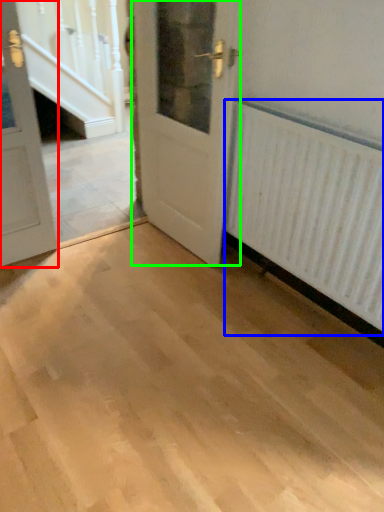
Question: Estimate the real-world distances between objects in this image. Which object is closer to door (highlighted by a red box), radiator (highlighted by a blue box) or door (highlighted by a green box)?

Choices:
 (A) radiator
 (B) door

Answer: (B)